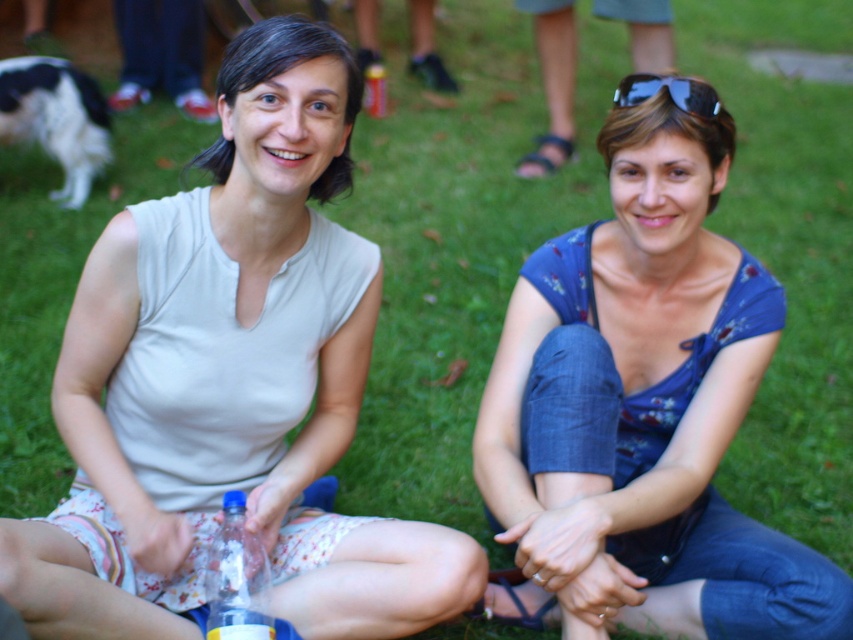
You are standing in the park where the two women are sitting. You want to place a small flag exactly halfway between the two points marked as point (57, 118) and point (216, 541). Will the flag be closer to the woman on the left or the woman on the right?

The flag placed halfway between point (57, 118) and point (216, 541) will be closer to the woman on the right because point (57, 118) is closer to the viewer than point (216, 541).

You are a photographer trying to capture a candid shot of both the white cotton tank top at center and the black and white fur at upper left. Since you want to ensure both are in focus, you need to know their relative sizes. Which object is taller?

The white cotton tank top at center is taller than the black and white fur at upper left.

You are taking a photo of two women sitting on the grass. You want to focus on the woman on the left holding a bottle. Which point, point (317, 212) or point (0, 70), is closer to the camera and thus better for focusing on her?

Point (317, 212) is closer to the camera than point (0, 70), so it is better for focusing on the woman on the left holding a bottle.